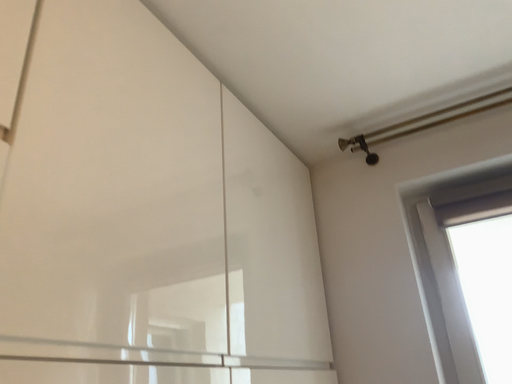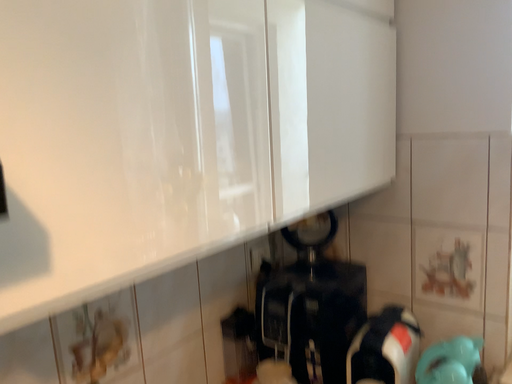
Question: Which way did the camera rotate in the video?

Choices:
 (A) rotated downward
 (B) rotated upward

Answer: (A)